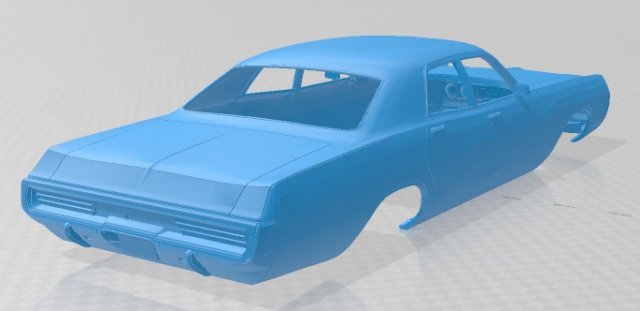
I want to click on door, so click(x=451, y=150), click(x=502, y=140).